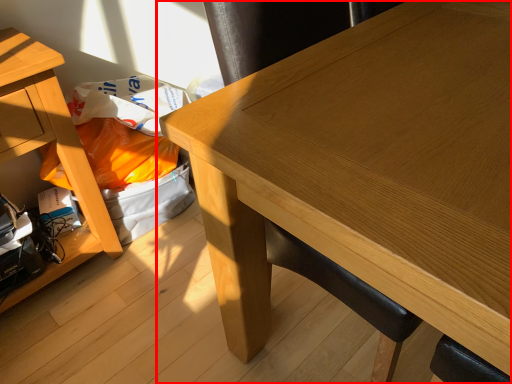
Question: From the image's perspective, what is the correct spatial positioning of table (annotated by the red box) in reference to table?

Choices:
 (A) above
 (B) below

Answer: (A)